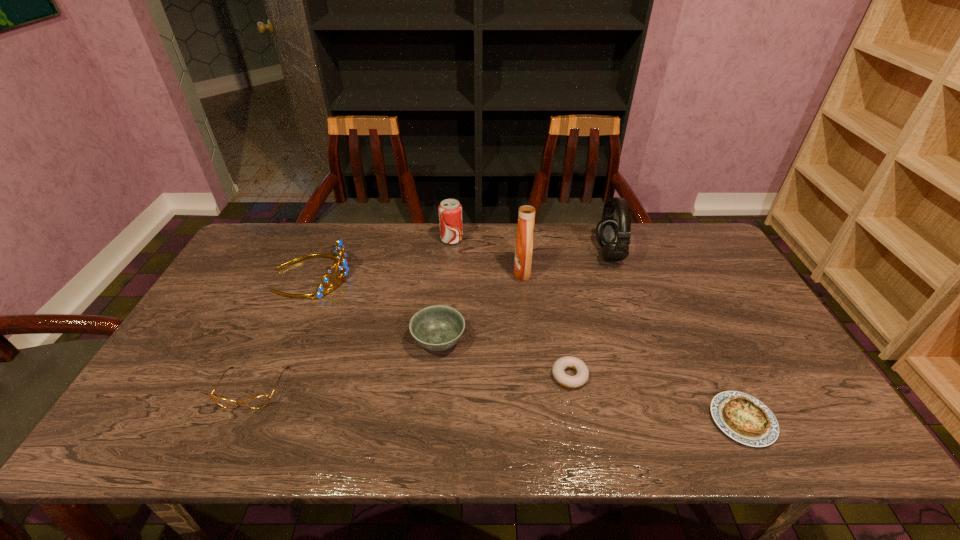
Locate an element on the screen. Image resolution: width=960 pixels, height=540 pixels. detergent is located at coordinates (524, 240).

Locate an element on the screen. the tallest object is located at coordinates (524, 240).

At what (x,y) coordinates should I click in order to perform the action: click on the seventh object from left to right. Please return your answer as a coordinate pair (x, y). The width and height of the screenshot is (960, 540). Looking at the image, I should click on (612, 235).

Identify the location of headset. Image resolution: width=960 pixels, height=540 pixels. (612, 235).

Where is `soda can`? This screenshot has width=960, height=540. soda can is located at coordinates (450, 210).

The image size is (960, 540). Identify the location of tiara. (338, 250).

You are a GUI agent. You are given a task and a screenshot of the screen. Output one action in this format:
    pyautogui.click(x=<x>, y=<y>)
    Task: Click on the fourth shortest object
    
    Given the screenshot: What is the action you would take?
    pyautogui.click(x=436, y=328)

Identify the location of spectacles. (260, 401).

The width and height of the screenshot is (960, 540). Find the location of `doughnut`. doughnut is located at coordinates (578, 380).

Where is `quiche`? quiche is located at coordinates (742, 417).